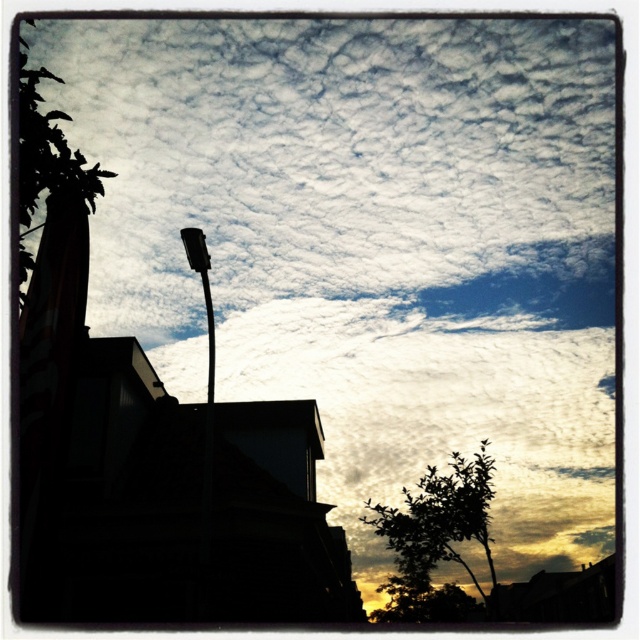
Question: Where is silhouette leafy tree at lower right located in relation to black glossy streetlight at upper center in the image?

Choices:
 (A) above
 (B) below

Answer: (B)

Question: Which point is farther to the camera?

Choices:
 (A) (19, 74)
 (B) (208, 390)

Answer: (B)

Question: Estimate the real-world distances between objects in this image. Which object is farther from the silhouette leafy tree at lower right?

Choices:
 (A) green leafy tree at upper left
 (B) black glossy streetlight at upper center

Answer: (B)

Question: Does silhouette leafy tree at lower right come behind green leafy tree at upper left?

Choices:
 (A) no
 (B) yes

Answer: (B)

Question: Which object is farther from the camera taking this photo?

Choices:
 (A) black glossy streetlight at upper center
 (B) green leafy tree at upper left

Answer: (A)

Question: Does silhouette leafy tree at lower right have a larger size compared to black glossy streetlight at upper center?

Choices:
 (A) yes
 (B) no

Answer: (A)